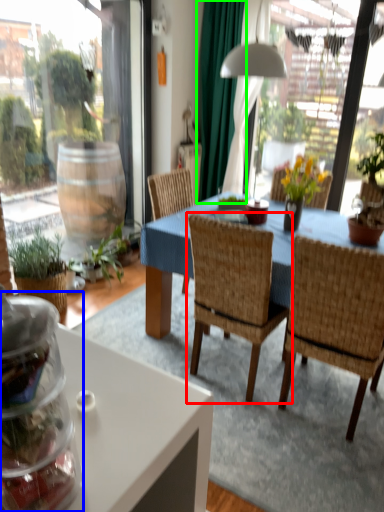
Question: Which is farther away from chair (highlighted by a red box)? glass jar (highlighted by a blue box) or curtain (highlighted by a green box)?

Choices:
 (A) glass jar
 (B) curtain

Answer: (B)